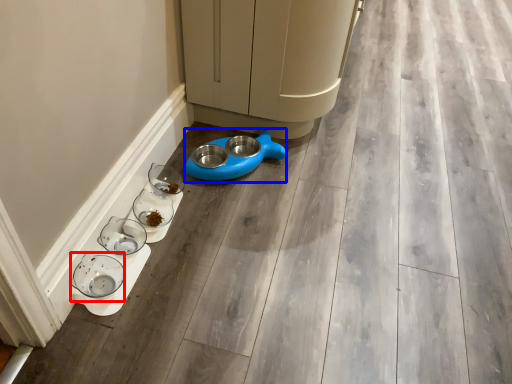
Question: Which point is further to the camera, glass bowl (highlighted by a red box) or appliance (highlighted by a blue box)?

Choices:
 (A) glass bowl
 (B) appliance

Answer: (B)